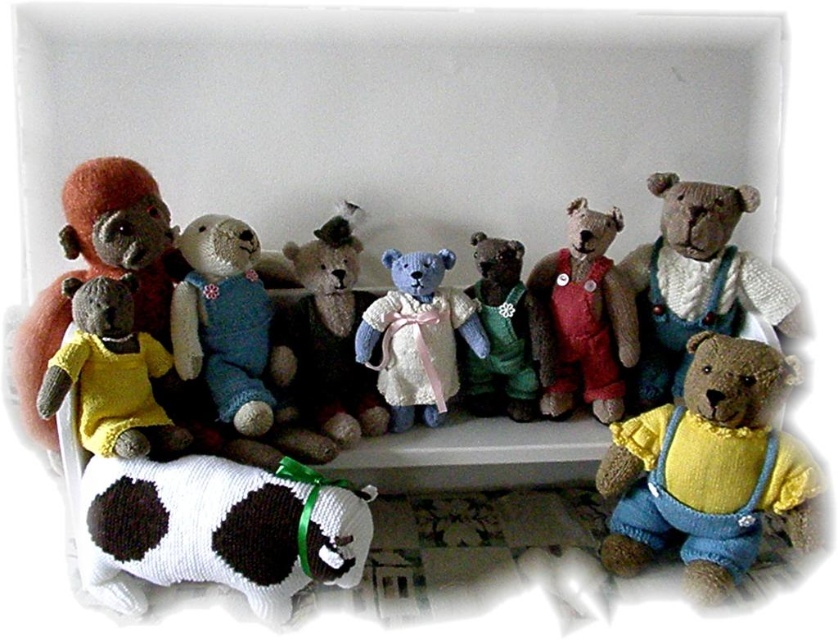
Question: Which point appears closest to the camera in this image?

Choices:
 (A) (552, 266)
 (B) (273, 497)
 (C) (428, 396)

Answer: (B)

Question: Does knitted yellow sweater at center come behind knitted red overalls at center?

Choices:
 (A) yes
 (B) no

Answer: (B)

Question: Which object appears closest to the camera in this image?

Choices:
 (A) knitted wool teddy bear at center
 (B) knitted green overalls at center
 (C) white knitted cow at lower left
 (D) knitted beige bear at center

Answer: (C)

Question: Is white knitted cow at lower left bigger than fluffy wool monkey at left?

Choices:
 (A) no
 (B) yes

Answer: (B)

Question: Which point is farther to the camera?

Choices:
 (A) knitted blue bear at center
 (B) knitted yellow dress at center

Answer: (A)

Question: Does knitted red overalls at center appear on the right side of knitted green overalls at center?

Choices:
 (A) yes
 (B) no

Answer: (A)